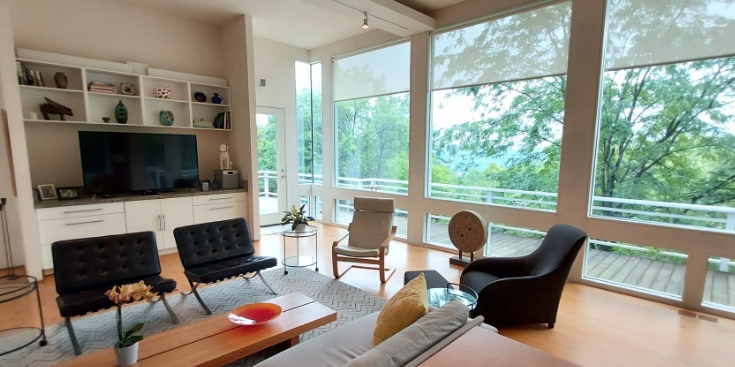
The image size is (735, 367). Identify the location of side table. (14, 289), (301, 231).